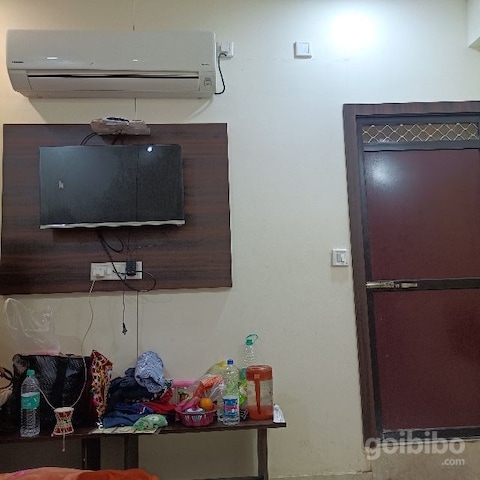
I want to click on outlets, so click(x=230, y=50), click(x=141, y=276).